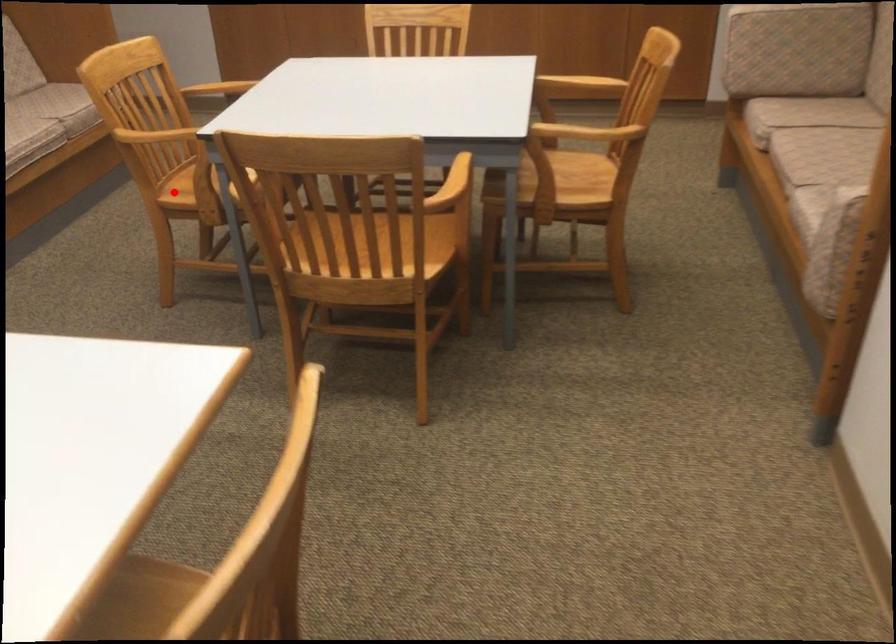
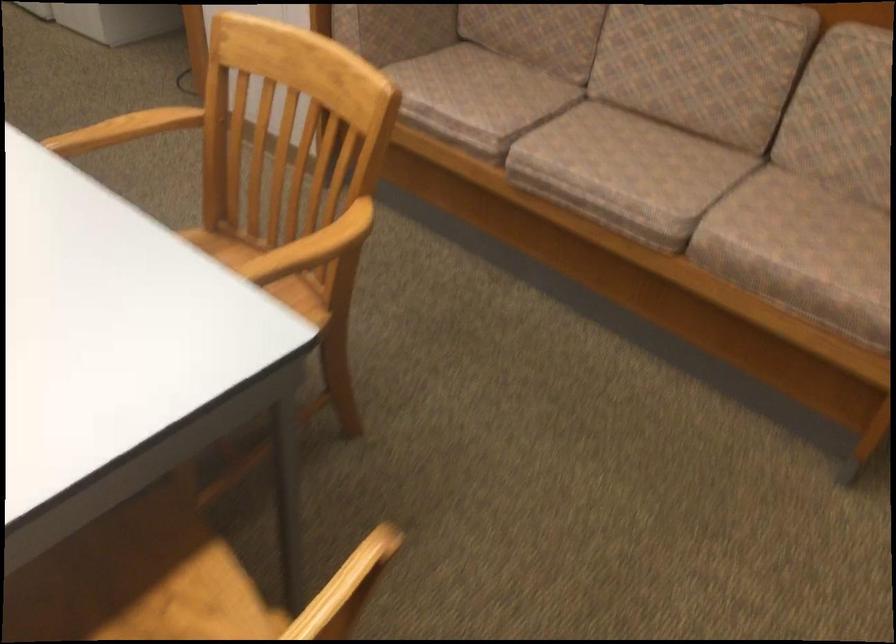
Locate, in the second image, the point that corresponds to the highlighted location in the first image.

(218, 247)